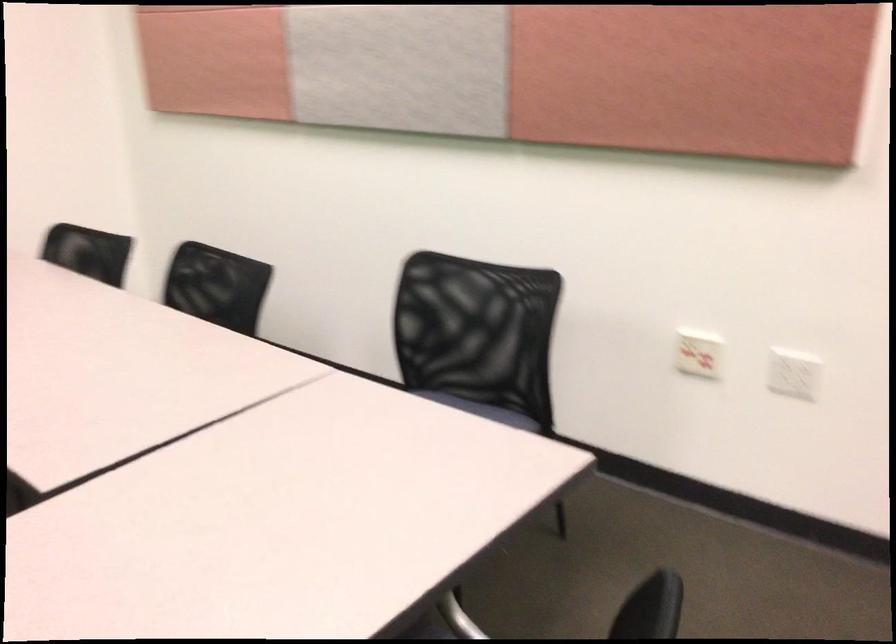
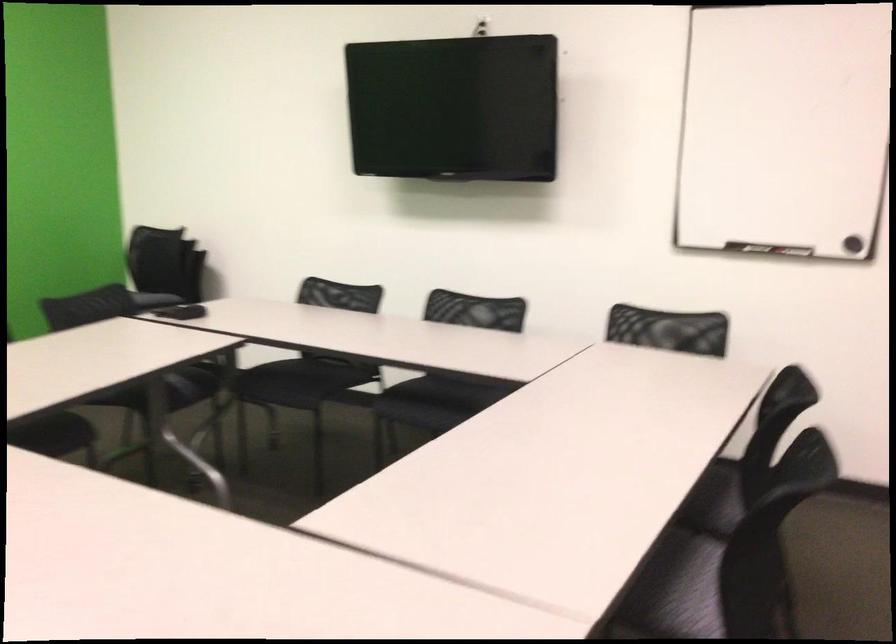
The point at (156, 333) is marked in the first image. Where is the corresponding point in the second image?

(722, 491)